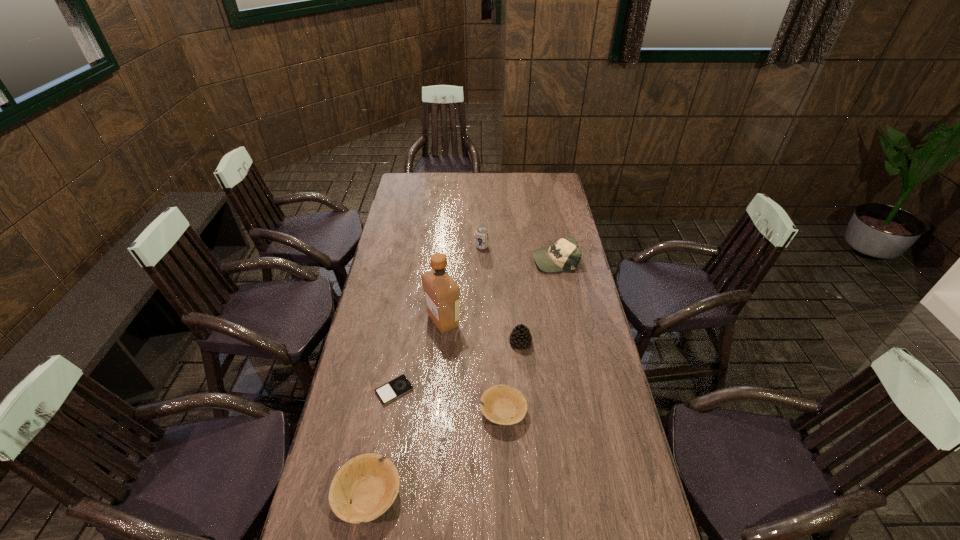
Locate an element on the screen. The image size is (960, 540). bowl that is at the left edge is located at coordinates (370, 482).

The width and height of the screenshot is (960, 540). I want to click on iPod that is at the left edge, so click(x=399, y=386).

Where is `object present at the right edge`? The image size is (960, 540). object present at the right edge is located at coordinates (564, 255).

The image size is (960, 540). Identify the location of object that is at the near left corner. (370, 482).

Locate an element on the screen. vacant area at the far edge of the desktop is located at coordinates (529, 177).

You are a GUI agent. You are given a task and a screenshot of the screen. Output one action in this format:
    pyautogui.click(x=<x>, y=<y>)
    Task: Click on the free spot at the near edge of the desktop
    Image resolution: width=960 pixels, height=540 pixels.
    Given the screenshot: What is the action you would take?
    pyautogui.click(x=536, y=519)

In the image, there is a desktop. What are the coordinates of `vacant space at the left edge` in the screenshot? It's located at pyautogui.click(x=375, y=362).

Identify the location of vacant area at the right edge of the desktop. Image resolution: width=960 pixels, height=540 pixels. (574, 279).

You are a GUI agent. You are given a task and a screenshot of the screen. Output one action in this format:
    pyautogui.click(x=<x>, y=<y>)
    Task: Click on the vacant space that is in between the baseball cap and the nearest object
    The image size is (960, 540).
    Given the screenshot: What is the action you would take?
    pyautogui.click(x=462, y=377)

This screenshot has width=960, height=540. In order to click on free space that is in between the shortest object and the left bowl in this screenshot , I will do `click(381, 443)`.